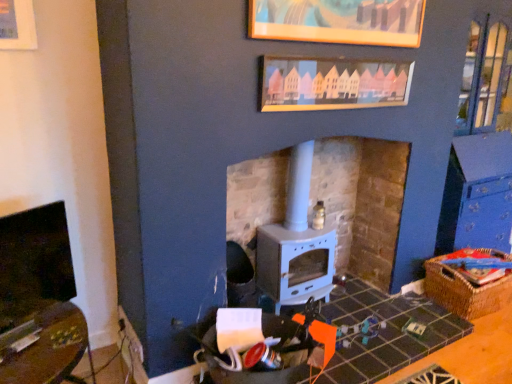
Question: From the image's perspective, is wooden picture frame at upper center, the 2th picture frame from the bottom, located above or below wooden picture frame at upper center, the first picture frame positioned from the bottom?

Choices:
 (A) above
 (B) below

Answer: (A)

Question: Based on their sizes in the image, would you say wooden picture frame at upper center, which is the 1th picture frame in top-to-bottom order, is bigger or smaller than wooden picture frame at upper center, the first picture frame positioned from the bottom?

Choices:
 (A) small
 (B) big

Answer: (B)

Question: Estimate the real-world distances between objects in this image. Which object is closer to the white matte wood burning stove at center?

Choices:
 (A) wooden picture frame at upper center, the 2th picture frame from the bottom
 (B) woven brown basket at lower right
 (C) matte black fireplace at left
 (D) wooden picture frame at upper center, the first picture frame positioned from the bottom

Answer: (D)

Question: Which object is positioned closest to the wooden picture frame at upper center, the first picture frame positioned from the bottom?

Choices:
 (A) wooden picture frame at upper center, which is the 1th picture frame in top-to-bottom order
 (B) matte black fireplace at left
 (C) white matte wood burning stove at center
 (D) woven brown basket at lower right

Answer: (A)